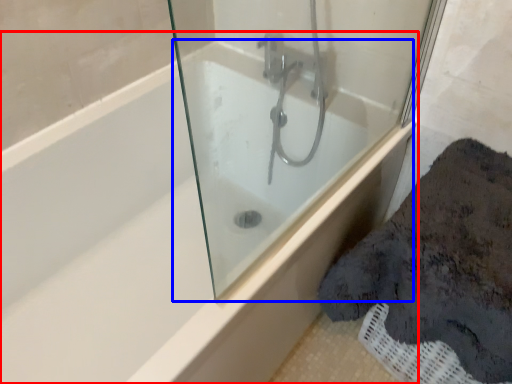
Question: Which object is closer to the camera taking this photo, bathtub (highlighted by a red box) or bath (highlighted by a blue box)?

Choices:
 (A) bathtub
 (B) bath

Answer: (B)